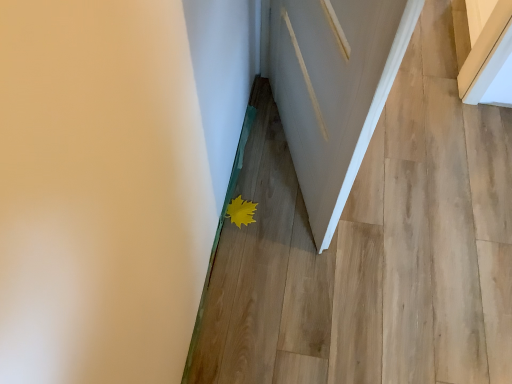
The height and width of the screenshot is (384, 512). What are the coordinates of `vacant space in between white wood door at center and yellow matte leaf at lower center` in the screenshot? It's located at (261, 180).